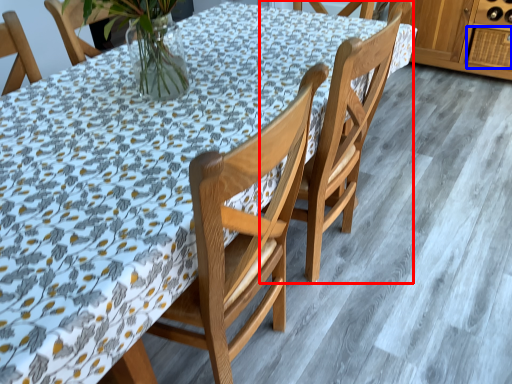
Question: Among these objects, which one is nearest to the camera, chair (highlighted by a red box) or drawer (highlighted by a blue box)?

Choices:
 (A) chair
 (B) drawer

Answer: (A)